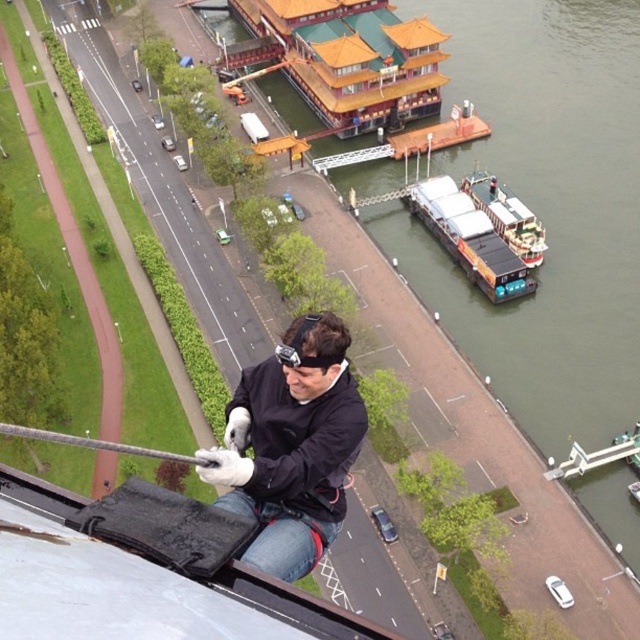
Is the position of black matte jacket at center less distant than that of white matte boat at center-right?

Yes, it is.

Which is more to the right, black matte jacket at center or white matte boat at center-right?

Positioned to the right is white matte boat at center-right.

Does point (323, 380) come closer to viewer compared to point (490, 177)?

Yes, it is.

The width and height of the screenshot is (640, 640). I want to click on black matte jacket at center, so click(291, 449).

Does yellow matte barge at right come behind white matte boat at center-right?

No, it is in front of white matte boat at center-right.

Between point (499, 285) and point (529, 241), which one is positioned in front?

Positioned in front is point (499, 285).

The width and height of the screenshot is (640, 640). I want to click on yellow matte barge at right, so click(468, 237).

Does white matte boat at center-right have a lesser width compared to black matte goggles at center?

No.

Where is `white matte boat at center-right`? The height and width of the screenshot is (640, 640). white matte boat at center-right is located at coordinates (508, 216).